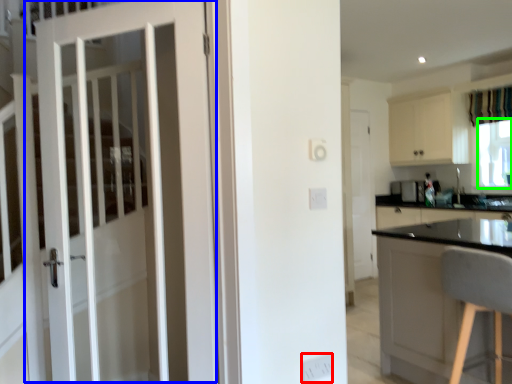
Question: Considering the real-world distances, which object is farthest from electric outlet (highlighted by a red box)? door (highlighted by a blue box) or window screen (highlighted by a green box)?

Choices:
 (A) door
 (B) window screen

Answer: (B)